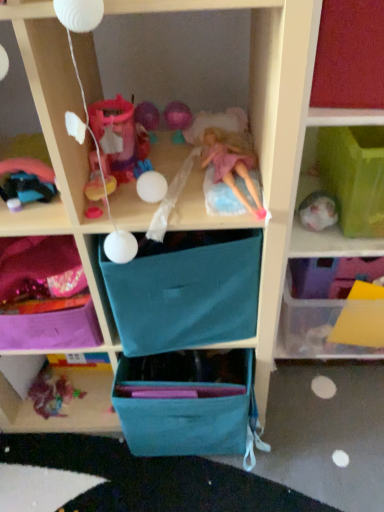
Locate an element on the screen. The width and height of the screenshot is (384, 512). vacant area that is situated to the right of multicolored fabric toy at lower left, which is counted as the 2th toy, starting from the top is located at coordinates (98, 401).